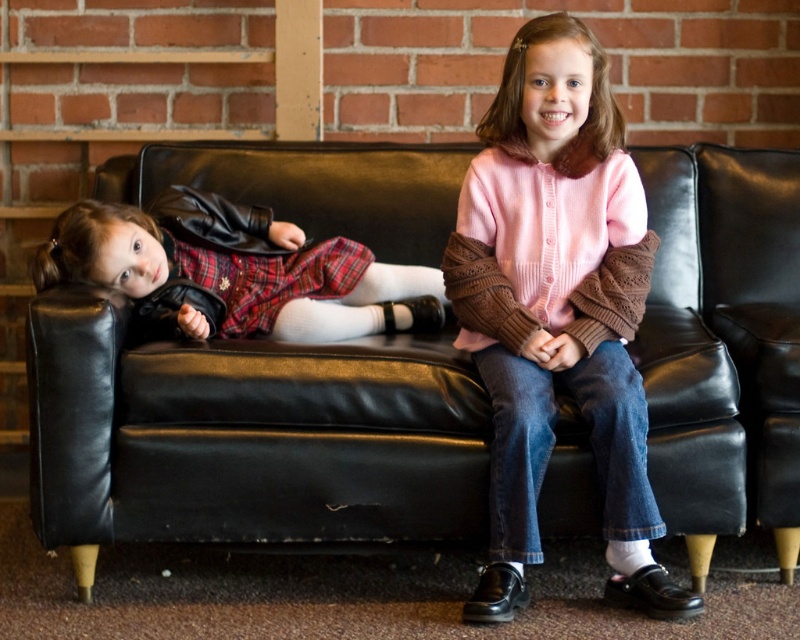
Question: Which point is farther to the camera?

Choices:
 (A) (381, 266)
 (B) (594, 196)

Answer: (A)

Question: Does pink knitted sweater at center have a larger size compared to matte black jacket at left?

Choices:
 (A) no
 (B) yes

Answer: (B)

Question: Which object is positioned farthest from the black leather couch at right?

Choices:
 (A) black leather couch at center
 (B) matte black jacket at left

Answer: (B)

Question: Can you confirm if black leather couch at center is wider than matte black jacket at left?

Choices:
 (A) yes
 (B) no

Answer: (A)

Question: Which of the following is the farthest from the observer?

Choices:
 (A) (212, 278)
 (B) (592, 92)
 (C) (752, 248)
 (D) (482, 508)

Answer: (C)

Question: Is matte black jacket at left to the right of black leather couch at right from the viewer's perspective?

Choices:
 (A) no
 (B) yes

Answer: (A)